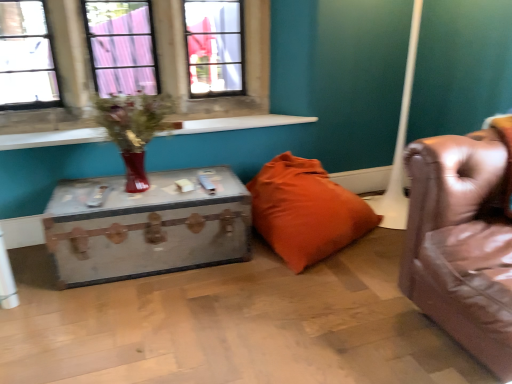
Question: Considering the relative sizes of orange fabric pillow at center and white smooth window sill at upper left in the image provided, is orange fabric pillow at center wider than white smooth window sill at upper left?

Choices:
 (A) no
 (B) yes

Answer: (B)

Question: Does orange fabric pillow at center have a greater height compared to white smooth window sill at upper left?

Choices:
 (A) yes
 (B) no

Answer: (A)

Question: From the image's perspective, is orange fabric pillow at center located beneath white smooth window sill at upper left?

Choices:
 (A) no
 (B) yes

Answer: (B)

Question: Would you consider orange fabric pillow at center to be distant from white smooth window sill at upper left?

Choices:
 (A) yes
 (B) no

Answer: (B)

Question: From the image's perspective, does orange fabric pillow at center appear higher than white smooth window sill at upper left?

Choices:
 (A) no
 (B) yes

Answer: (A)

Question: Based on their positions, is white smooth window sill at upper left located to the left or right of rustic wood trunk at center?

Choices:
 (A) right
 (B) left

Answer: (A)

Question: Considering the positions of white smooth window sill at upper left and rustic wood trunk at center in the image, is white smooth window sill at upper left wider or thinner than rustic wood trunk at center?

Choices:
 (A) wide
 (B) thin

Answer: (B)

Question: Is white smooth window sill at upper left bigger or smaller than rustic wood trunk at center?

Choices:
 (A) small
 (B) big

Answer: (A)

Question: Is white smooth window sill at upper left taller or shorter than rustic wood trunk at center?

Choices:
 (A) tall
 (B) short

Answer: (B)

Question: Looking at their shapes, would you say orange fabric pillow at center is wider or thinner than matte glass vase at upper left?

Choices:
 (A) wide
 (B) thin

Answer: (A)

Question: From the image's perspective, is orange fabric pillow at center positioned above or below matte glass vase at upper left?

Choices:
 (A) above
 (B) below

Answer: (B)

Question: Is point (351, 238) positioned closer to the camera than point (138, 132)?

Choices:
 (A) closer
 (B) farther

Answer: (B)

Question: Which is correct: orange fabric pillow at center is inside matte glass vase at upper left, or outside of it?

Choices:
 (A) inside
 (B) outside

Answer: (B)

Question: From the image's perspective, is matte glass vase at upper left located above or below white smooth window sill at upper left?

Choices:
 (A) above
 (B) below

Answer: (B)

Question: In terms of width, does matte glass vase at upper left look wider or thinner when compared to white smooth window sill at upper left?

Choices:
 (A) thin
 (B) wide

Answer: (B)